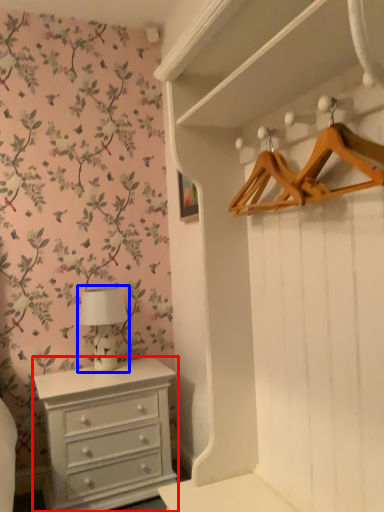
Question: Among these objects, which one is nearest to the camera, chest of drawers (highlighted by a red box) or table lamp (highlighted by a blue box)?

Choices:
 (A) chest of drawers
 (B) table lamp

Answer: (A)